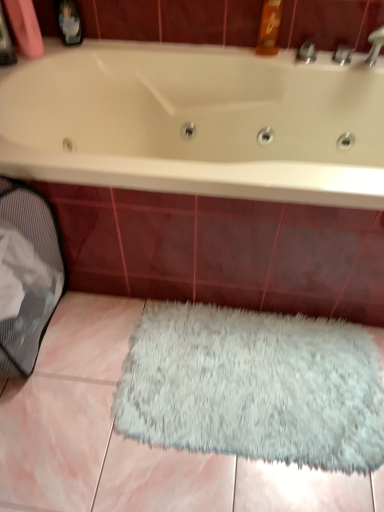
Question: From a real-world perspective, is white glossy bathtub at upper center physically located above or below gray mesh laundry basket at lower left?

Choices:
 (A) below
 (B) above

Answer: (B)

Question: From the image's perspective, is white glossy bathtub at upper center located above or below gray mesh laundry basket at lower left?

Choices:
 (A) above
 (B) below

Answer: (A)

Question: Based on their relative distances, which object is nearer to the gray mesh laundry basket at lower left?

Choices:
 (A) white glossy bathtub at upper center
 (B) white fluffy rug at lower center

Answer: (A)

Question: Considering the real-world distances, which object is farthest from the white fluffy rug at lower center?

Choices:
 (A) white glossy bathtub at upper center
 (B) gray mesh laundry basket at lower left

Answer: (A)